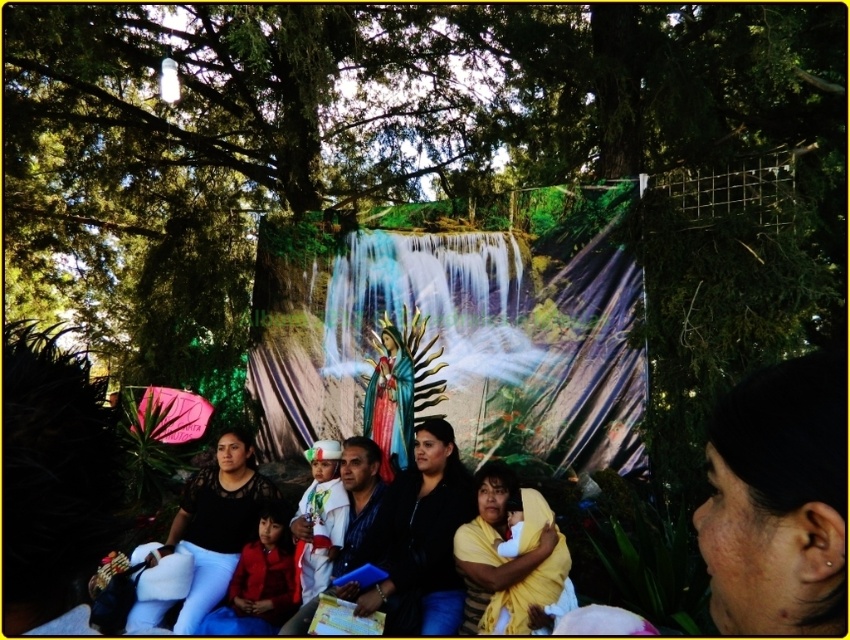
You are a photographer standing at the edge of the platform where the group is seated. You want to capture a photo that includes both the matte black clothing at center and the red velvet dress at lower left. What is the minimum distance you need to move backward to ensure both subjects are in frame?

The matte black clothing at center and red velvet dress at lower left are 1.35 meters apart. To include both in the frame, you need to move backward until the camera can accommodate a 1.35 meter width between them, which typically requires a distance dependent on lens focal length. However, without specific lens details, the minimum distance can be estimated using the rule of thumb that doubling the distance halves the apparent width. For example, if the current distance is 2 meters, moving to 4 meters may

You are a photographer planning to take a photo of the scene. You want to ensure that both the metallic blue water at center and the matte black clothing at center are clearly visible. Considering their heights, which object might appear larger in the photo and why?

The metallic blue water at center appears larger in the photo because it has a greater height compared to the matte black clothing at center.